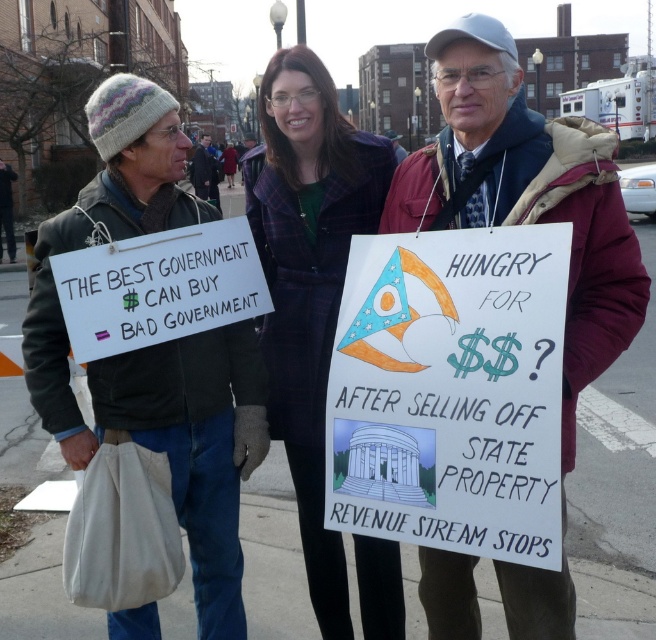
Question: Can you confirm if knit wool hat at upper left is wider than maroon woolen jacket at center?

Choices:
 (A) no
 (B) yes

Answer: (B)

Question: Which point is closer to the camera?

Choices:
 (A) plaid wool coat at center
 (B) maroon woolen jacket at center
 (C) knit wool hat at upper left
 (D) white paper sign at center

Answer: (D)

Question: Based on their relative distances, which object is nearer to the plaid wool coat at center?

Choices:
 (A) white paper sign at center
 (B) maroon woolen jacket at center
 (C) dark blue jacket at center
 (D) white paper sign at left

Answer: (D)

Question: Which object is farther from the camera taking this photo?

Choices:
 (A) dark blue jacket at center
 (B) white paper sign at center
 (C) plaid wool coat at center

Answer: (A)

Question: Is white paper sign at center above white paper sign at left?

Choices:
 (A) yes
 (B) no

Answer: (B)

Question: Does plaid wool coat at center appear on the right side of dark blue jacket at center?

Choices:
 (A) yes
 (B) no

Answer: (A)